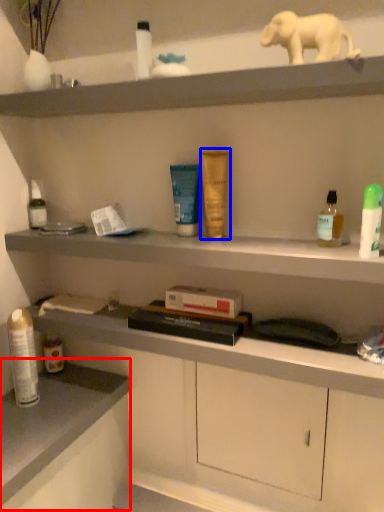
Question: Which object appears closest to the camera in this image, counter top (highlighted by a red box) or toiletry (highlighted by a blue box)?

Choices:
 (A) counter top
 (B) toiletry

Answer: (A)